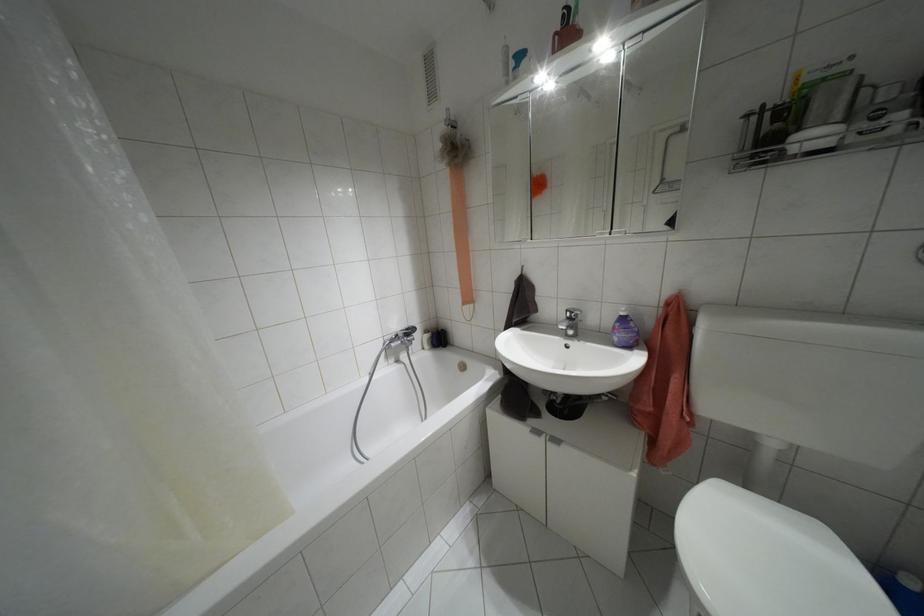
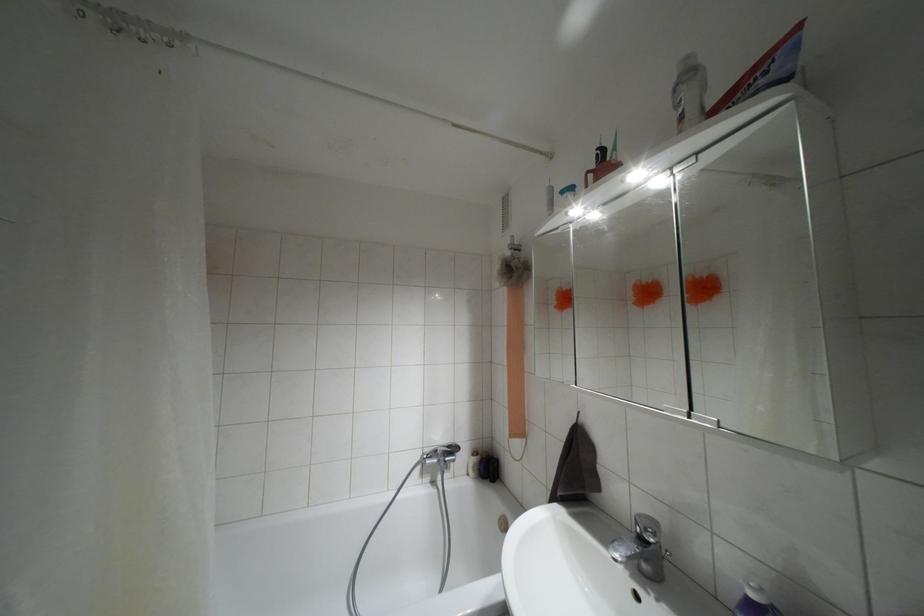
Find the pixel in the second image that matches [455,156] in the first image.

(509, 277)